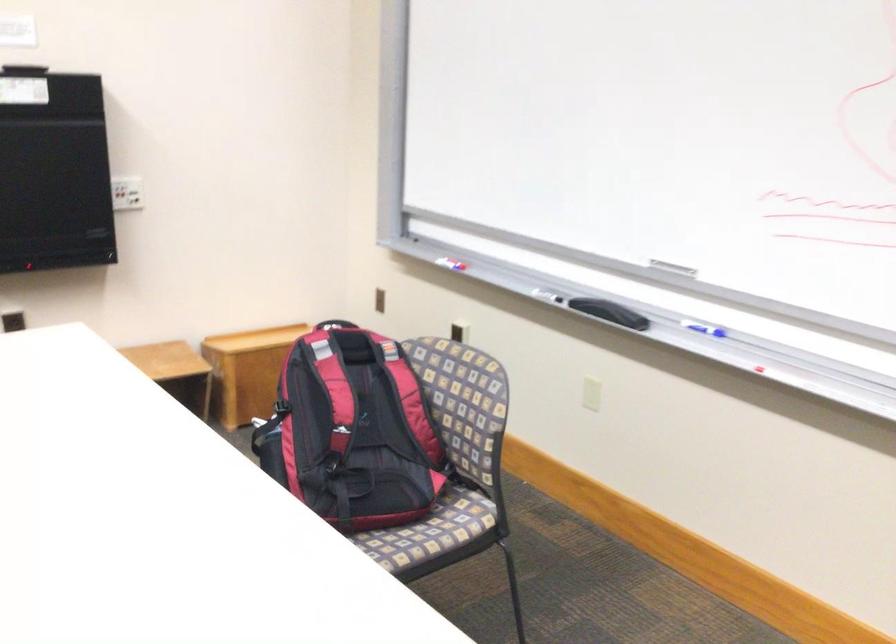
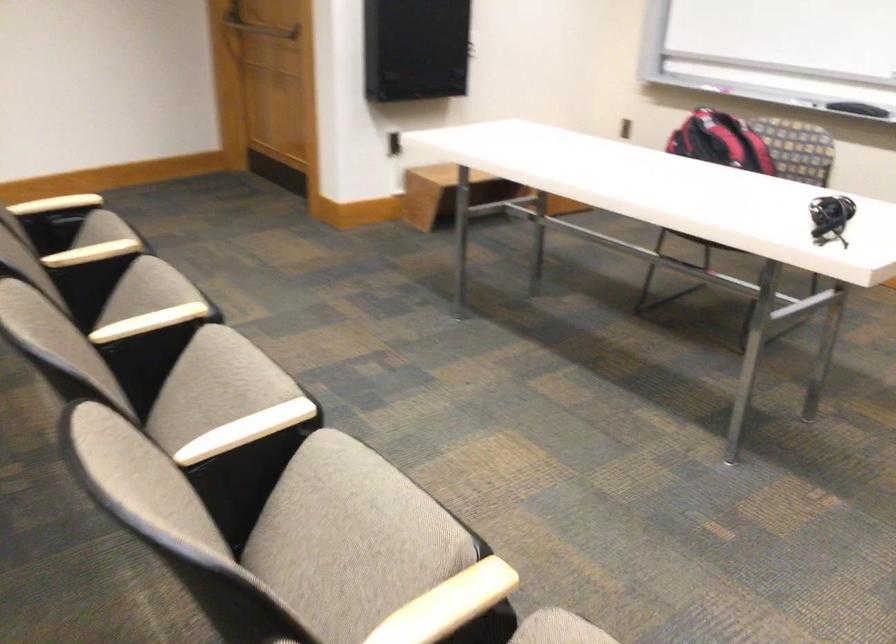
Question: I am providing you with two images of the same scene from different viewpoints. Please identify which objects are invisible in image2.

Choices:
 (A) small wooden box
 (B) black whiteboard eraser
 (C) black dropper top
 (D) chair sitting surface

Answer: (A)